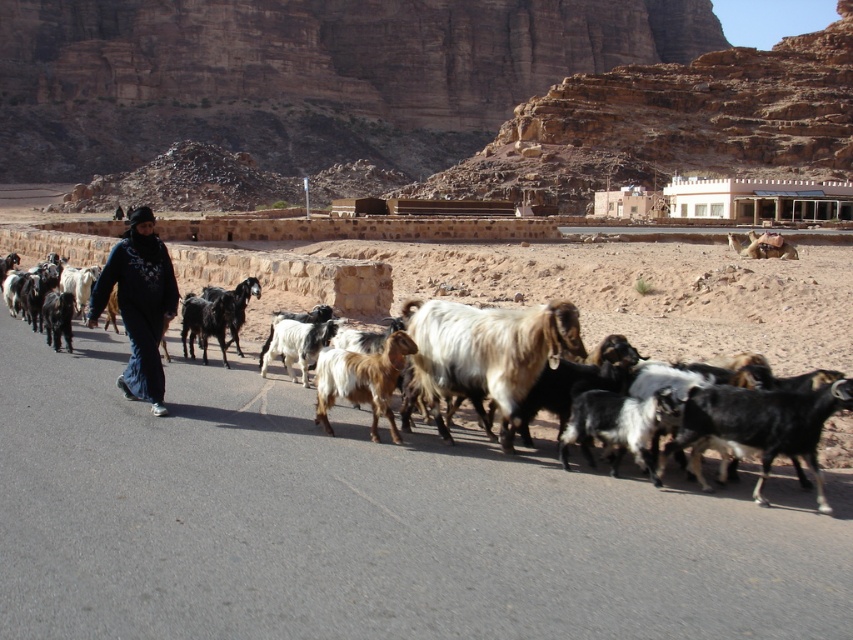
You are a goat herder guiding your flock along the road. You notice two points marked on the path ahead. The first point is at coordinates point (x=751, y=412) and the second is at point (x=321, y=372). Which point should you aim to reach first if you want to follow the correct path?

You should aim to reach point (x=751, y=412) first because it is in front of point (x=321, y=372) along the path.

You are standing on the road in the desert scene. There is a specific point marked at coordinates point [584,392]. If you want to reach that point without disturbing the goats, which direction should you move in relation to the paved road?

The point [584,392] is 17.30 meters away from the viewer, so you should move forward along the paved road towards that point.

You are a herder trying to move your goats across a road. You have a rope that is 4 meters long. Can you use it to connect the shaggy brown goat at center and the brown woolen goat at center to keep them together?

The distance between the shaggy brown goat at center and the brown woolen goat at center is 4.63 meters. Since the rope is only 4 meters long, it would not be sufficient to connect them both.